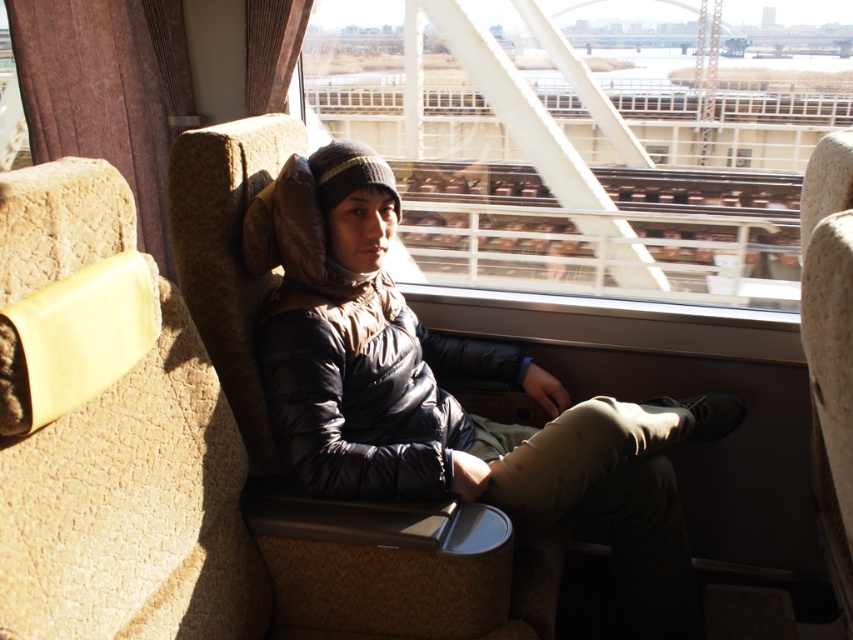
Between point (573, 81) and point (329, 212), which one is positioned behind?

Point (573, 81)

Is transparent glass train window at center taller than matte black jacket at center?

Yes.

Locate an element on the screen. transparent glass train window at center is located at coordinates (567, 161).

The image size is (853, 640). In order to click on transparent glass train window at center in this screenshot , I will do click(567, 161).